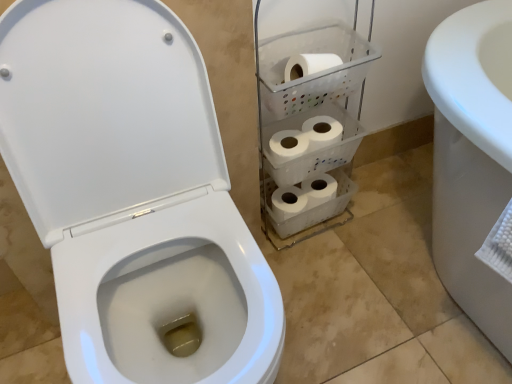
Question: Is white plastic shelf at center closer to camera compared to white matte toilet paper at center?

Choices:
 (A) yes
 (B) no

Answer: (A)

Question: Does white plastic shelf at center have a lesser width compared to white matte toilet paper at center?

Choices:
 (A) yes
 (B) no

Answer: (B)

Question: Is white plastic shelf at center oriented away from white matte toilet paper at center?

Choices:
 (A) yes
 (B) no

Answer: (A)

Question: From the image's perspective, is white plastic shelf at center on top of white matte toilet paper at center?

Choices:
 (A) yes
 (B) no

Answer: (B)

Question: Can you confirm if white plastic shelf at center is positioned to the right of white matte toilet paper at center?

Choices:
 (A) no
 (B) yes

Answer: (B)

Question: Does white plastic shelf at center have a lesser height compared to white matte toilet paper at center?

Choices:
 (A) yes
 (B) no

Answer: (B)

Question: Is white glossy toilet at left further to the viewer compared to white matte toilet paper at center?

Choices:
 (A) no
 (B) yes

Answer: (A)

Question: Is white glossy toilet at left outside of white matte toilet paper at center?

Choices:
 (A) no
 (B) yes

Answer: (B)

Question: From the image's perspective, is white glossy toilet at left below white matte toilet paper at center?

Choices:
 (A) no
 (B) yes

Answer: (B)

Question: Does white glossy toilet at left have a greater height compared to white matte toilet paper at center?

Choices:
 (A) yes
 (B) no

Answer: (A)

Question: Is white glossy toilet at left in front of white matte toilet paper at center?

Choices:
 (A) yes
 (B) no

Answer: (A)

Question: From the image's perspective, does white glossy toilet at left appear higher than white matte toilet paper at center?

Choices:
 (A) yes
 (B) no

Answer: (B)

Question: Does white plastic shelf at center have a greater height compared to white glossy toilet at left?

Choices:
 (A) no
 (B) yes

Answer: (A)